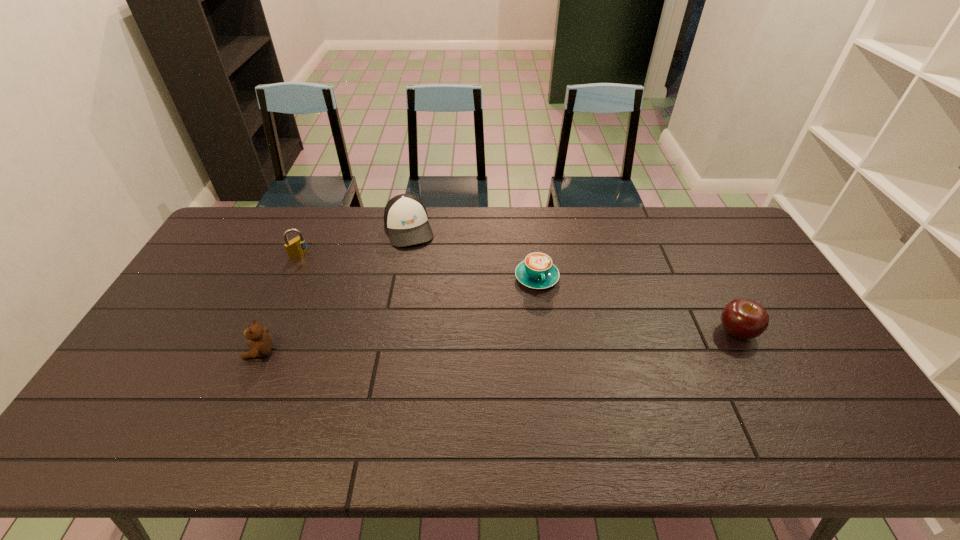
Where is `free space between the padlock and the teddy bear`? free space between the padlock and the teddy bear is located at coordinates (280, 303).

Find the location of `free space that is in between the third object from left to right and the rightmost object`. free space that is in between the third object from left to right and the rightmost object is located at coordinates (572, 280).

Identify the location of vacant space that is in between the cap and the teddy bear. Image resolution: width=960 pixels, height=540 pixels. (334, 290).

Identify the location of vacant area that lies between the rightmost object and the padlock. Image resolution: width=960 pixels, height=540 pixels. (518, 293).

This screenshot has height=540, width=960. I want to click on vacant space that is in between the cap and the padlock, so click(354, 241).

Locate which object is the fourth closest to the teddy bear. Please provide its 2D coordinates. Your answer should be formatted as a tuple, i.e. [(x, y)], where the tuple contains the x and y coordinates of a point satisfying the conditions above.

[(744, 319)]

Find the location of a particular element. object identified as the closest to the third object from right to left is located at coordinates (296, 247).

Identify the location of vacant space that satisfies the following two spatial constraints: 1. on the front side of the teddy bear; 2. at the face of the padlock. Image resolution: width=960 pixels, height=540 pixels. (257, 352).

Find the location of a particular element. blank space that satisfies the following two spatial constraints: 1. on the front side of the rightmost object; 2. on the right side of the second object from right to left is located at coordinates (544, 332).